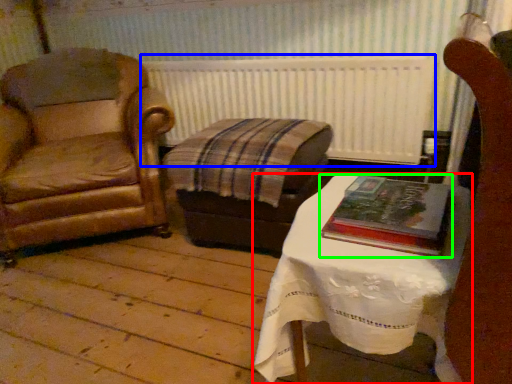
Question: Which is nearer to the table (highlighted by a red box)? radiator (highlighted by a blue box) or book (highlighted by a green box).

Choices:
 (A) radiator
 (B) book

Answer: (B)